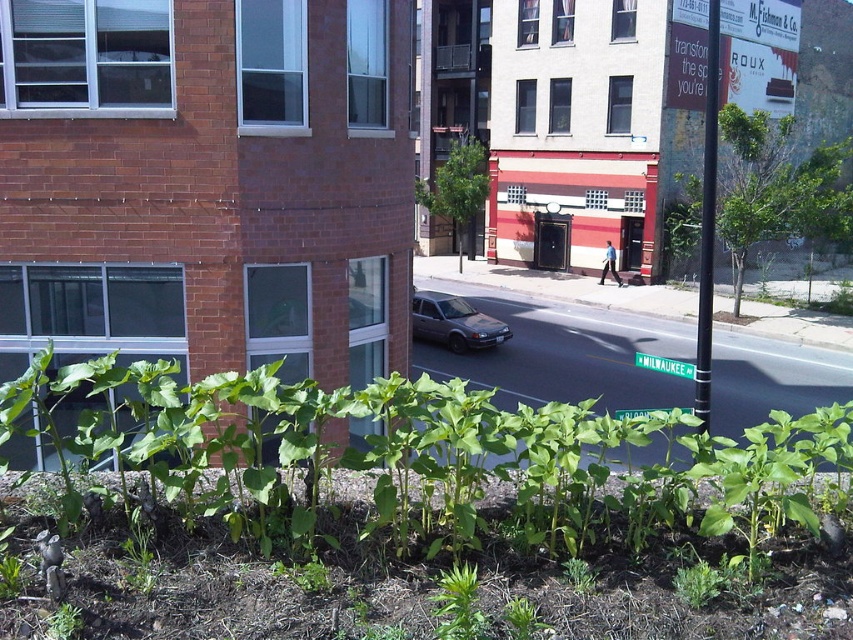
You are a delivery driver who needs to park your satin silver sedan at center in a parking spot that can only accommodate vehicles up to the size of the green plastic street sign at lower center. Can your sedan fit?

The satin silver sedan at center is smaller than the green plastic street sign at lower center, so it can fit in the parking spot.

You are a delivery driver who needs to park your 2.5 meters long satin silver sedan at center without blocking the green plastic street sign at lower center. Is this possible?

The satin silver sedan at center is positioned over green plastic street sign at lower center, so parking it there would block the sign. Choose a different spot.

You are a delivery driver who needs to park your 1.8 meters tall delivery van. You see the satin silver sedan at center and the green plastic street sign at lower center. Can your van fit between them without hitting anything?

The satin silver sedan at center is taller than the green plastic street sign at lower center. Since your van is 1.8 meters tall, and the sedan is taller than the sign, the limiting height would be the sedan. If the sedan is taller than 1.8 meters, the van can pass. However, since the exact height of the sedan isn